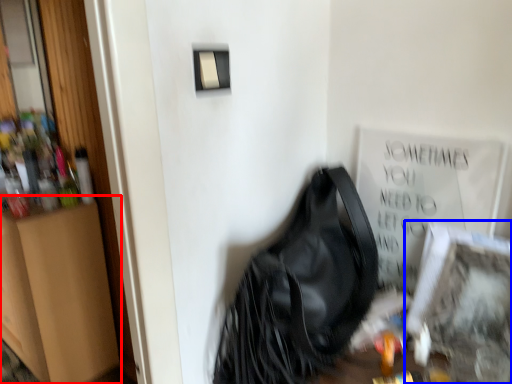
Question: Which object is further to the camera taking this photo, dresser (highlighted by a red box) or picture frame (highlighted by a blue box)?

Choices:
 (A) dresser
 (B) picture frame

Answer: (A)